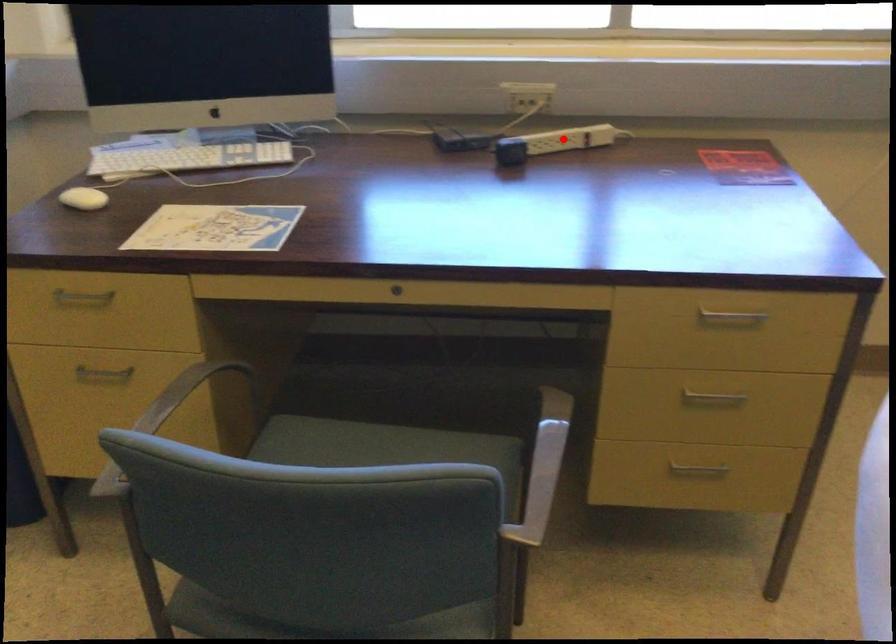
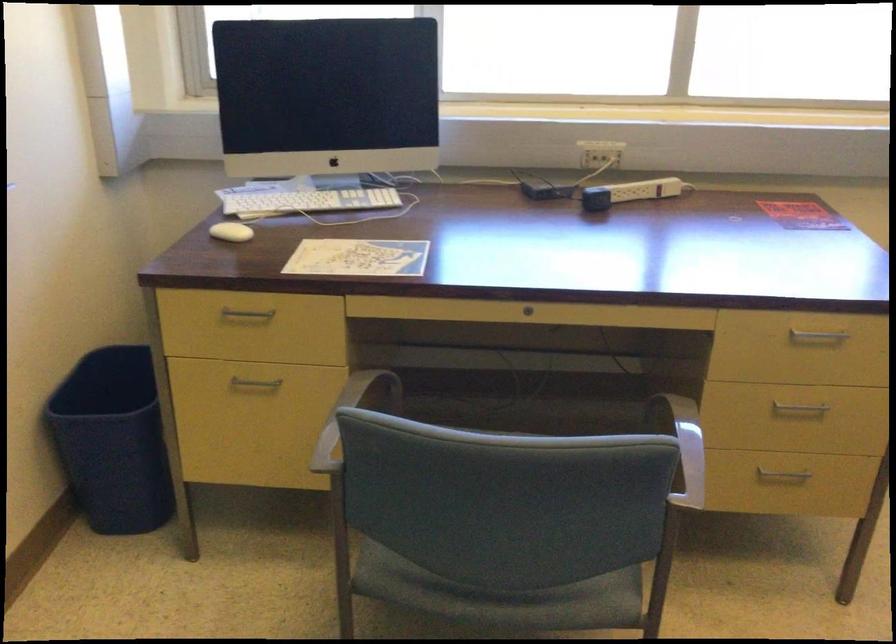
Where in the second image is the point corresponding to the highlighted location from the first image?

(642, 190)